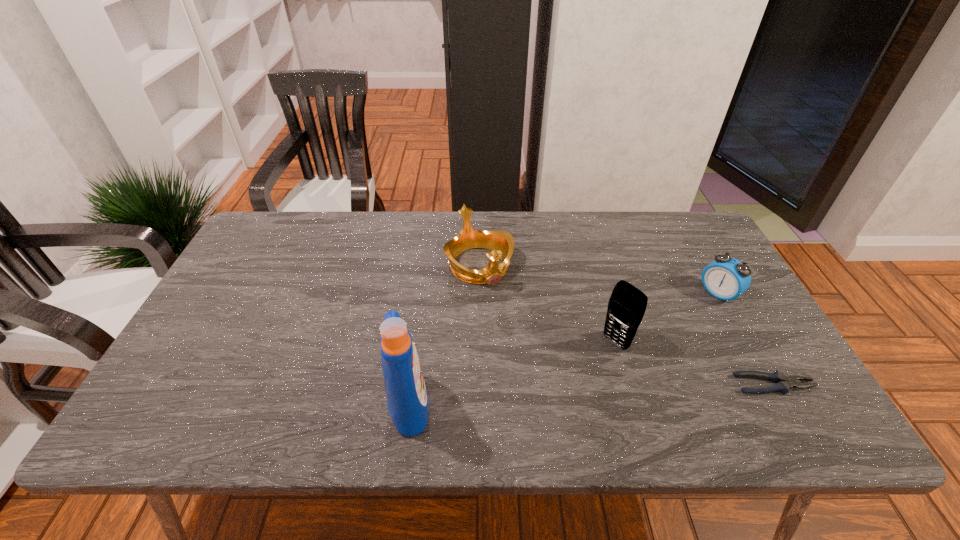
You are a GUI agent. You are given a task and a screenshot of the screen. Output one action in this format:
    pyautogui.click(x=<x>, y=<y>)
    Task: Click on the alarm clock positioned at the right edge
    
    Given the screenshot: What is the action you would take?
    pyautogui.click(x=726, y=278)

At what (x,y) coordinates should I click in order to perform the action: click on object at the near right corner. Please return your answer as a coordinate pair (x, y). The height and width of the screenshot is (540, 960). Looking at the image, I should click on (783, 383).

The width and height of the screenshot is (960, 540). Find the location of `free location at the far edge of the desktop`. free location at the far edge of the desktop is located at coordinates (612, 230).

At what (x,y) coordinates should I click in order to perform the action: click on free spot at the near edge of the desktop. Please return your answer as a coordinate pair (x, y). Looking at the image, I should click on (506, 381).

In the image, there is a desktop. In order to click on blank space at the left edge in this screenshot , I will do `click(213, 301)`.

Image resolution: width=960 pixels, height=540 pixels. Identify the location of vacant area at the right edge of the desktop. (769, 358).

The width and height of the screenshot is (960, 540). What are the coordinates of `vacant space at the far left corner of the desktop` in the screenshot? It's located at (249, 241).

This screenshot has height=540, width=960. In the image, there is a desktop. Find the location of `free region at the far right corner`. free region at the far right corner is located at coordinates (684, 256).

Find the location of a particular element. unoccupied position between the leftmost object and the pliers is located at coordinates (591, 394).

Identify the location of vacant region between the second tallest object and the detergent. The height and width of the screenshot is (540, 960). (512, 373).